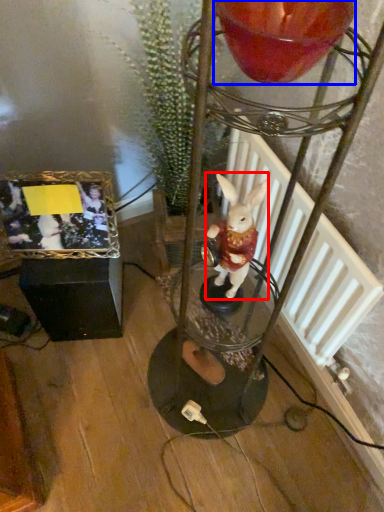
Question: Which object appears closest to the camera in this image, rabbit (highlighted by a red box) or candle holder (highlighted by a blue box)?

Choices:
 (A) rabbit
 (B) candle holder

Answer: (B)